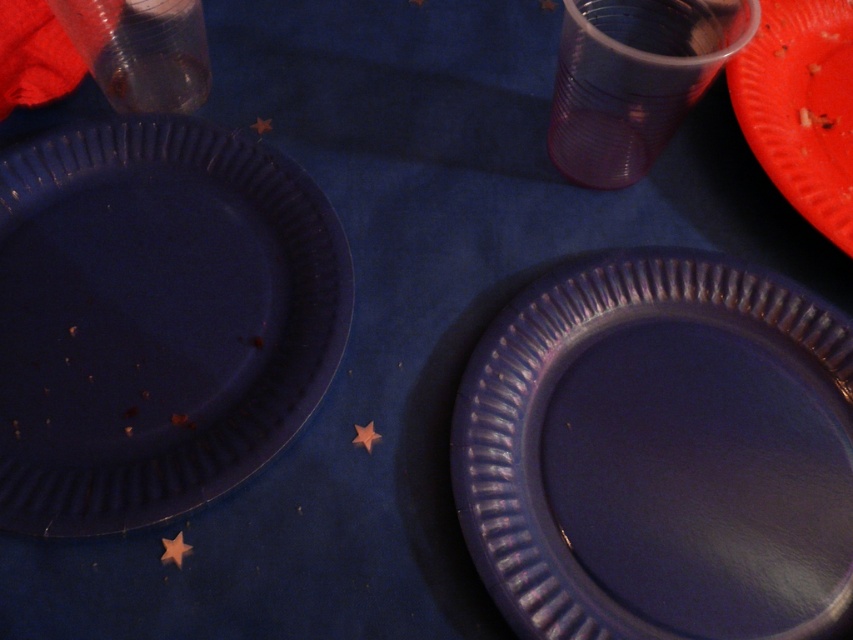
Question: From the image, what is the correct spatial relationship of matte blue plate at lower right in relation to matte blue plate at lower left?

Choices:
 (A) left
 (B) right

Answer: (B)

Question: Which of these objects is positioned farthest from the orange matte plate at upper right?

Choices:
 (A) matte blue plate at lower left
 (B) matte blue plate at lower right

Answer: (A)

Question: Among these points, which one is farthest from the camera?

Choices:
 (A) (842, 241)
 (B) (780, 449)
 (C) (225, 170)

Answer: (C)

Question: Can you confirm if matte blue plate at lower left is thinner than orange matte plate at upper right?

Choices:
 (A) yes
 (B) no

Answer: (B)

Question: Which object is closer to the camera taking this photo?

Choices:
 (A) matte blue plate at lower left
 (B) orange matte plate at upper right

Answer: (A)

Question: Does matte blue plate at lower left come in front of orange matte plate at upper right?

Choices:
 (A) yes
 (B) no

Answer: (A)